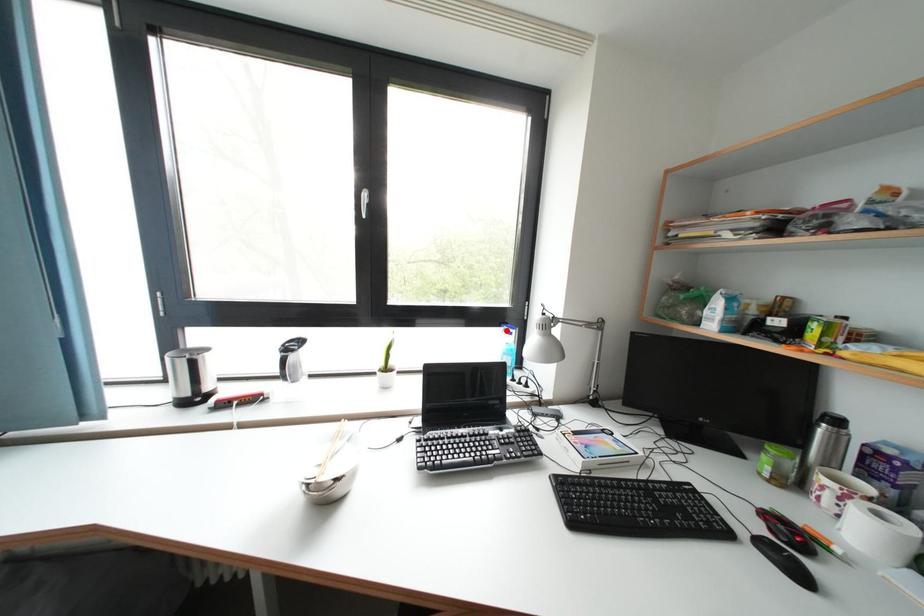
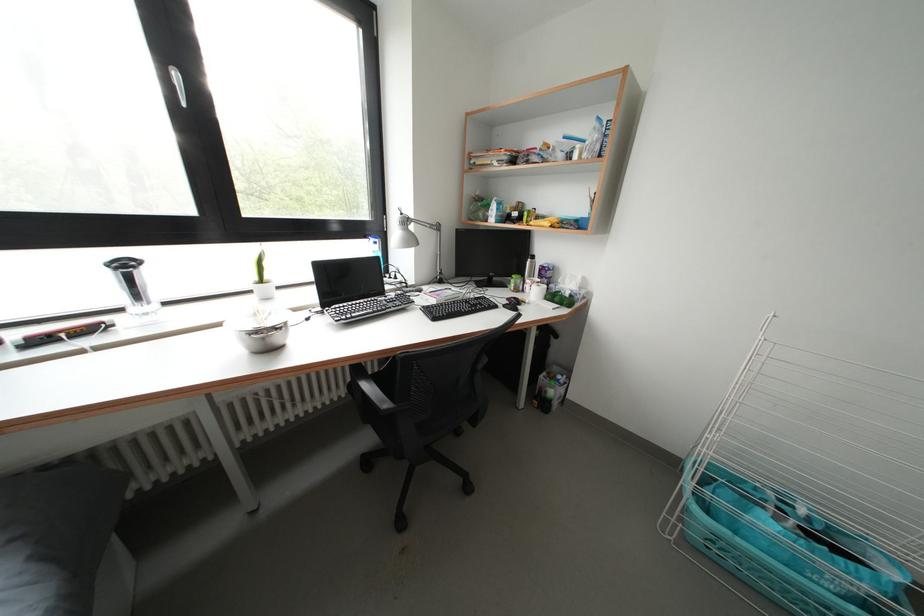
The point at the highlighted location is marked in the first image. Where is the corresponding point in the second image?

(371, 241)